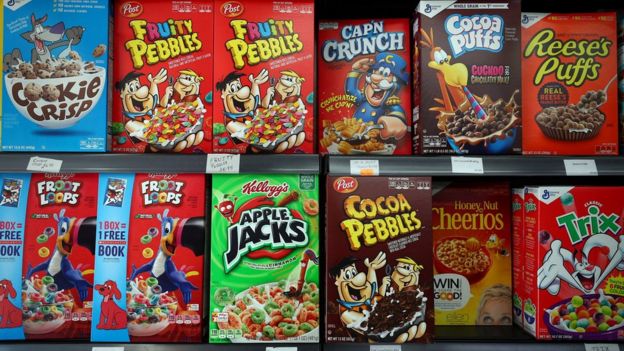
Identify the location of shelf labels. (47, 162), (225, 163), (368, 166), (468, 165), (576, 167), (603, 343), (395, 345), (285, 348), (108, 347).